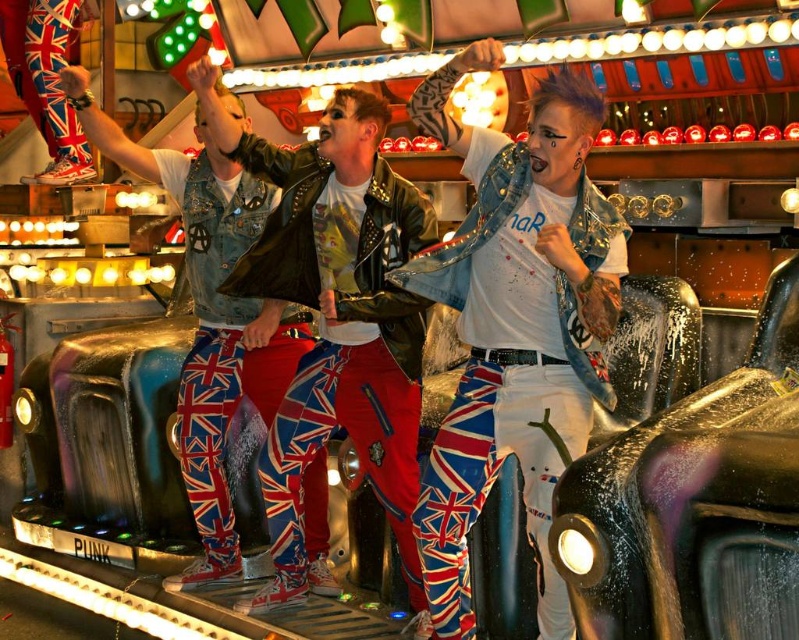
You are a photographer trying to capture the union jack pants at center from the front. Based on their position at point 0.495, 0.422, would you need to adjust your camera angle to get a clear shot from your current position?

The union jack pants at center is located at point 0.422, so you can adjust your camera angle slightly to capture them clearly from your current position.

You are a photographer at the event and want to capture a photo of the union jack pants at center and the metallic purple car at right. Based on their positions, which object is closer to the camera?

The union jack pants at center is located below metallic purple car at right, so the union jack pants at center is closer to the camera because it is positioned lower in the scene.

You are a photographer standing at the front of the stage where the union jack pants at center are being worn. You want to take a closeup shot of the pants but your camera can only focus on objects within 30 feet. Will you be able to take the closeup shot?

The union jack pants at center and viewer are 31.34 feet apart from each other. Since the camera can only focus within 30 feet, you are 1.34 feet too far away to take the closeup shot.